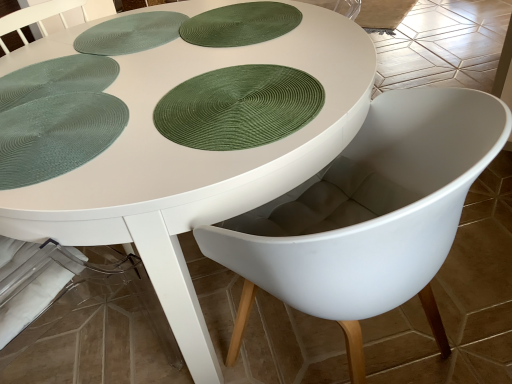
Question: In terms of height, does white matte poker table at center look taller or shorter compared to green textured placemat at left, marked as the fourth paper plate in a top-to-bottom arrangement?

Choices:
 (A) short
 (B) tall

Answer: (B)

Question: Is point (106, 51) positioned closer to the camera than point (90, 127)?

Choices:
 (A) farther
 (B) closer

Answer: (A)

Question: Which of these objects is positioned farthest from the green textured placemat at upper left, which appears as the 3th paper plate when ordered from the bottom?

Choices:
 (A) white matte table at center
 (B) white plastic chair at center
 (C) green textured placemat at upper center, arranged as the 4th paper plate when ordered from the bottom
 (D) green textured placemat at upper left
 (E) green woven placemat at center, which is counted as the third paper plate, starting from the top

Answer: (B)

Question: Based on their relative distances, which object is nearer to the white matte poker table at center?

Choices:
 (A) green textured placemat at upper left, which appears as the 3th paper plate when ordered from the bottom
 (B) white plastic chair at center
 (C) green textured placemat at upper left
 (D) white matte table at center
 (E) green textured placemat at upper center, the 1th paper plate viewed from the top

Answer: (A)